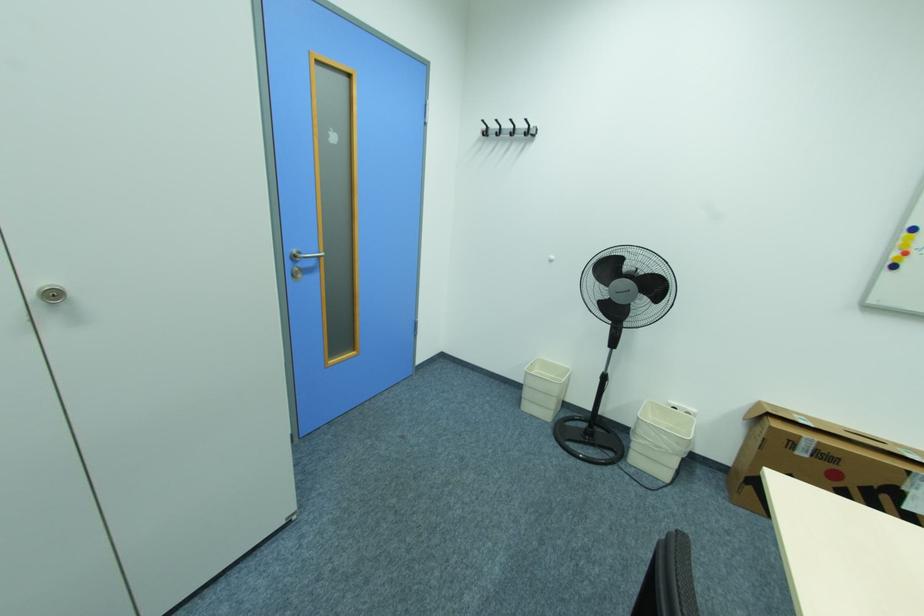
Identify the location of black wall hook. (507, 129).